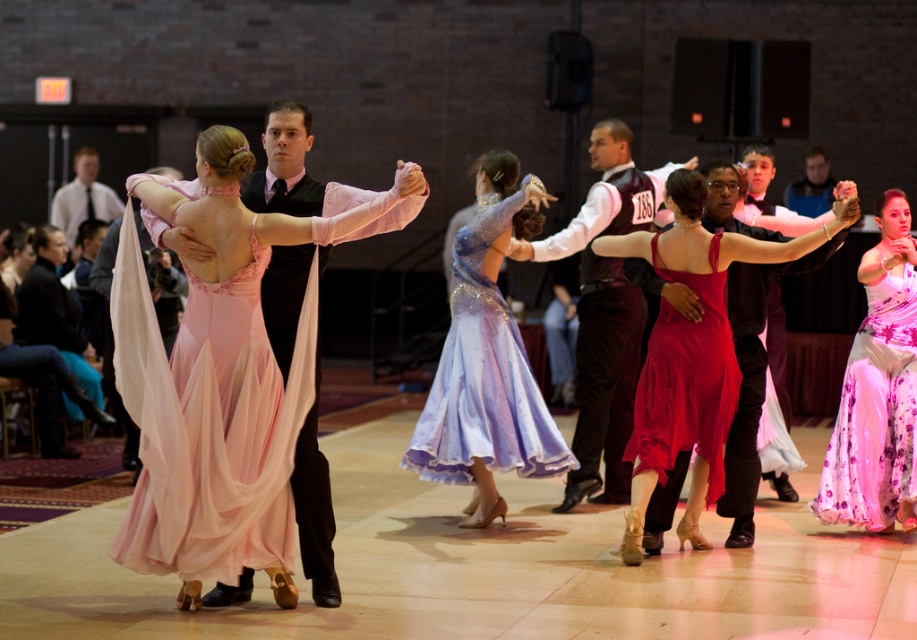
Question: Is shiny red dress at center behind matte black vest at upper right?

Choices:
 (A) yes
 (B) no

Answer: (B)

Question: Can you confirm if maroon satin vest at center is bigger than shiny red satin dress at center?

Choices:
 (A) no
 (B) yes

Answer: (B)

Question: Does matte pink chiffon dress at center appear under purple floral dress at lower right?

Choices:
 (A) yes
 (B) no

Answer: (A)

Question: Considering the real-world distances, which object is farthest from the pink chiffon dress at center?

Choices:
 (A) shiny red dress at center
 (B) maroon satin vest at center
 (C) matte black vest at upper left
 (D) matte black vest at upper right

Answer: (D)

Question: Which object is farther from the camera taking this photo?

Choices:
 (A) purple floral dress at lower right
 (B) shiny burgundy vest at center

Answer: (B)

Question: Which is nearer to the purple floral dress at lower right?

Choices:
 (A) matte black vest at upper left
 (B) maroon satin vest at center

Answer: (B)